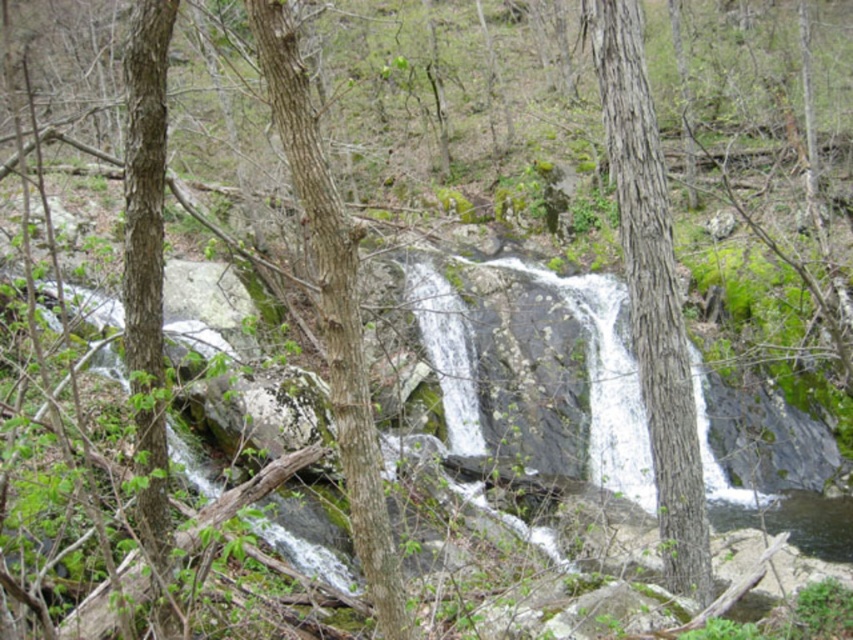
You are standing near the waterfall and want to reach the smooth bark tree at left. Which direction should you move relative to the brown rough bark tree at center?

You should move to the left of the brown rough bark tree at center to reach the smooth bark tree at left because the smooth bark tree at left is positioned to the left side of the brown rough bark tree at center.

You are a hiker standing at the base of the smooth bark tree at center and want to reach the top of the smooth bark tree at left. Which tree will you need to climb higher to reach its top?

The smooth bark tree at left is taller than the smooth bark tree at center, so you will need to climb higher to reach the top of the smooth bark tree at left.